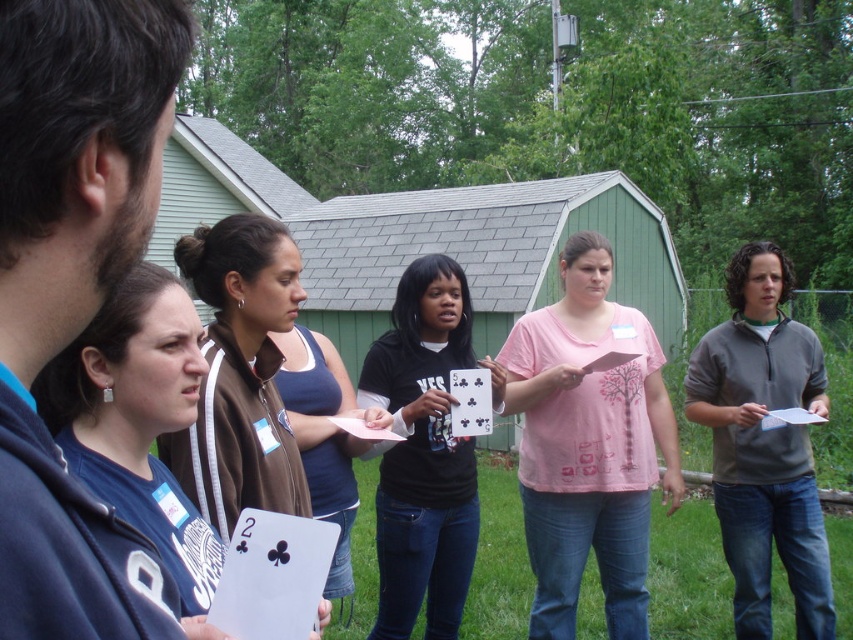
Is point (199, 518) closer to camera compared to point (483, 387)?

Yes, point (199, 518) is closer to viewer.

Between blue fabric shirt at center and black paper card at center, which one is positioned higher?

blue fabric shirt at center

Which is behind, point (125, 358) or point (463, 433)?

Point (463, 433)

Image resolution: width=853 pixels, height=640 pixels. I want to click on blue fabric shirt at center, so click(137, 419).

Who is taller, black paper card at center or pink paper at center?

black paper card at center

Who is positioned more to the right, black paper card at center or pink paper at center?

black paper card at center

Does point (453, 404) come closer to viewer compared to point (358, 436)?

No, (453, 404) is behind (358, 436).

The height and width of the screenshot is (640, 853). In order to click on black paper card at center in this screenshot , I will do `click(469, 401)`.

Can you confirm if pink fabric shirt at center is smaller than pink paper at center?

No, pink fabric shirt at center is not smaller than pink paper at center.

Does pink fabric shirt at center appear on the right side of pink paper at center?

Indeed, pink fabric shirt at center is positioned on the right side of pink paper at center.

Which is in front, point (546, 404) or point (370, 428)?

Point (370, 428) is in front.

Find the location of `pink fabric shirt at center`. pink fabric shirt at center is located at coordinates (589, 444).